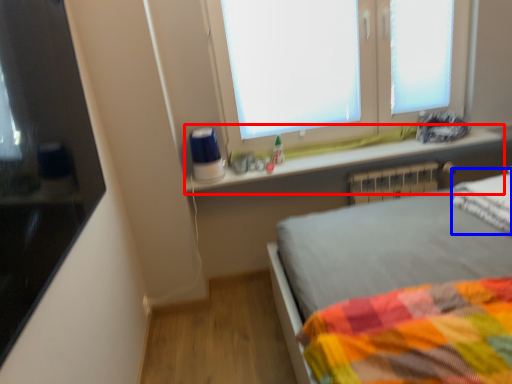
Question: Which of the following is the closest to the observer, window sill (highlighted by a red box) or pillow (highlighted by a blue box)?

Choices:
 (A) window sill
 (B) pillow

Answer: (B)